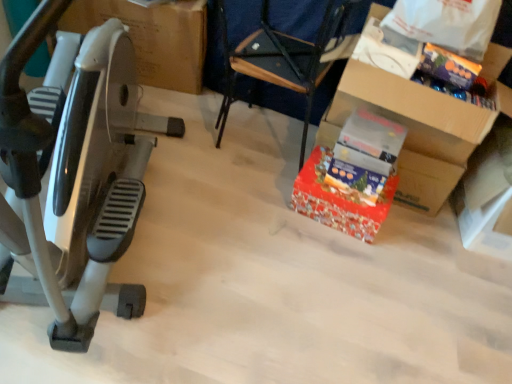
The height and width of the screenshot is (384, 512). I want to click on free space between silver metallic stationary bicycle at left and red glossy gift at center, positioned as the 1th gift in bottom-to-top order, so click(240, 249).